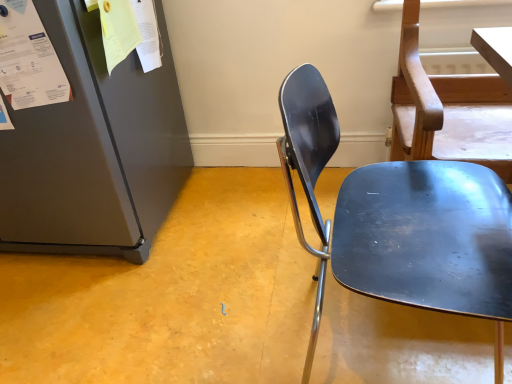
The image size is (512, 384). Describe the element at coordinates (29, 59) in the screenshot. I see `white paper at upper left` at that location.

Find the location of a particular element. The width and height of the screenshot is (512, 384). white paper at upper left is located at coordinates (29, 59).

What is the approximate width of metallic blue chair at center?

metallic blue chair at center is 21.65 inches wide.

The image size is (512, 384). In order to click on metallic blue chair at center in this screenshot , I will do `click(400, 221)`.

Describe the element at coordinates (400, 221) in the screenshot. I see `metallic blue chair at center` at that location.

Image resolution: width=512 pixels, height=384 pixels. I want to click on white paper at upper left, so click(x=29, y=59).

Does metallic blue chair at center appear on the right side of white paper at upper left?

Correct, you'll find metallic blue chair at center to the right of white paper at upper left.

Is metallic blue chair at center positioned before white paper at upper left?

Yes, metallic blue chair at center is in front of white paper at upper left.

Is point (421, 248) closer or farther from the camera than point (2, 11)?

Point (421, 248).

Consider the image. From the image's perspective, which one is positioned higher, metallic blue chair at center or white paper at upper left?

white paper at upper left.

Consider the image. From a real-world perspective, which is physically below, metallic blue chair at center or white paper at upper left?

metallic blue chair at center, from a real-world perspective.

Considering the sizes of metallic blue chair at center and white paper at upper left in the image, is metallic blue chair at center wider or thinner than white paper at upper left?

Considering their sizes, metallic blue chair at center looks broader than white paper at upper left.

Which of these two, metallic blue chair at center or white paper at upper left, stands shorter?

Standing shorter between the two is white paper at upper left.

Can you confirm if metallic blue chair at center is smaller than white paper at upper left?

No, metallic blue chair at center is not smaller than white paper at upper left.

Is white paper at upper left inside metallic blue chair at center?

Definitely not — white paper at upper left is not inside metallic blue chair at center.

Would you say metallic blue chair at center is a long distance from white paper at upper left?

Actually, metallic blue chair at center and white paper at upper left are a little close together.

Is metallic blue chair at center positioned with its back to white paper at upper left?

Yes.

Find the location of a particular element. Image resolution: width=512 pixels, height=384 pixels. chair on the right of white paper at upper left is located at coordinates (400, 221).

Is white paper at upper left at the right side of metallic blue chair at center?

No, white paper at upper left is not to the right of metallic blue chair at center.

Considering the relative positions of white paper at upper left and metallic blue chair at center in the image provided, is white paper at upper left in front of metallic blue chair at center?

No.

Does point (45, 78) come in front of point (312, 178)?

No, it is behind (312, 178).

Consider the image. From the image's perspective, is white paper at upper left above or below metallic blue chair at center?

From the image's perspective, white paper at upper left appears above metallic blue chair at center.

From a real-world perspective, is white paper at upper left positioned above or below metallic blue chair at center?

From a real-world perspective, white paper at upper left is physically above metallic blue chair at center.

From the picture: Considering the sizes of objects white paper at upper left and metallic blue chair at center in the image provided, who is thinner, white paper at upper left or metallic blue chair at center?

white paper at upper left is thinner.

From the picture: Considering the sizes of white paper at upper left and metallic blue chair at center in the image, is white paper at upper left taller or shorter than metallic blue chair at center?

white paper at upper left is shorter than metallic blue chair at center.

Considering the sizes of objects white paper at upper left and metallic blue chair at center in the image provided, who is bigger, white paper at upper left or metallic blue chair at center?

With larger size is metallic blue chair at center.

Would you say white paper at upper left is inside or outside metallic blue chair at center?

white paper at upper left is outside metallic blue chair at center.

Is white paper at upper left far from metallic blue chair at center?

No.

Is white paper at upper left turned away from metallic blue chair at center?

No.

Measure the distance between white paper at upper left and metallic blue chair at center.

They are 33.05 inches apart.

Where is `paper above the metallic blue chair at center (from a real-world perspective)`? paper above the metallic blue chair at center (from a real-world perspective) is located at coordinates (29, 59).

Where is `paper that is above the metallic blue chair at center (from a real-world perspective)`? The width and height of the screenshot is (512, 384). paper that is above the metallic blue chair at center (from a real-world perspective) is located at coordinates (29, 59).

Identify the location of chair located underneath the white paper at upper left (from a real-world perspective). This screenshot has height=384, width=512. (400, 221).